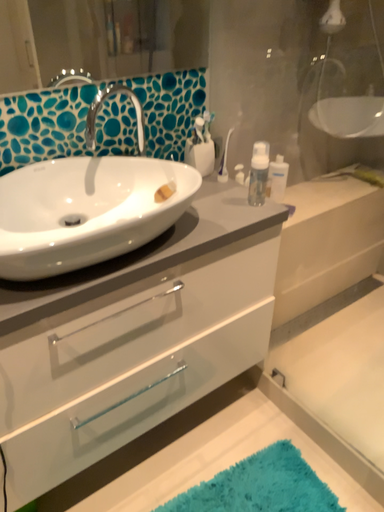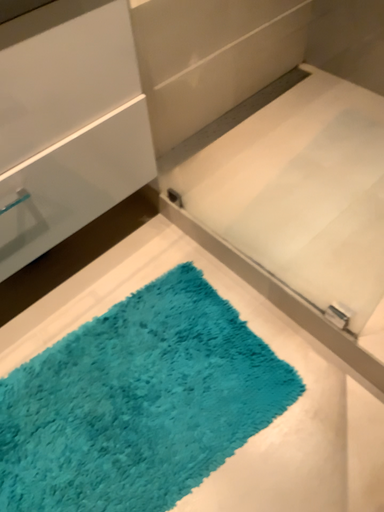
Question: How did the camera likely rotate when shooting the video?

Choices:
 (A) rotated upward
 (B) rotated downward

Answer: (B)